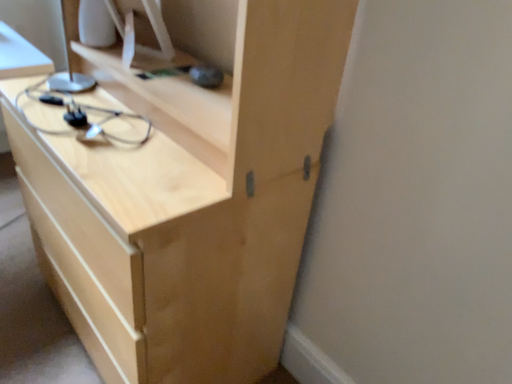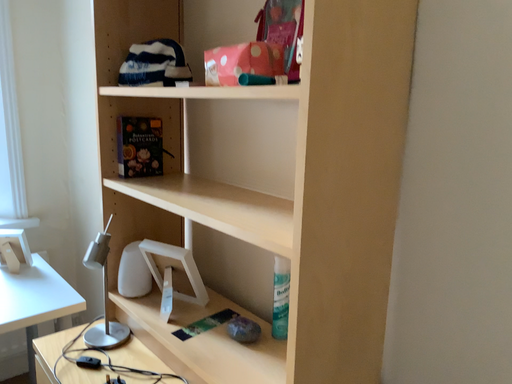
Question: Which way did the camera rotate in the video?

Choices:
 (A) rotated downward
 (B) rotated upward

Answer: (B)